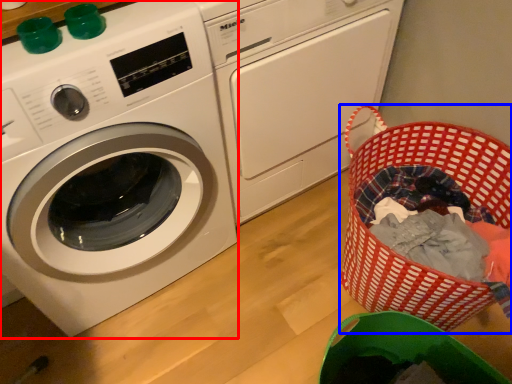
Question: Which object is closer to the camera taking this photo, washing machine (highlighted by a red box) or basket (highlighted by a blue box)?

Choices:
 (A) washing machine
 (B) basket

Answer: (A)